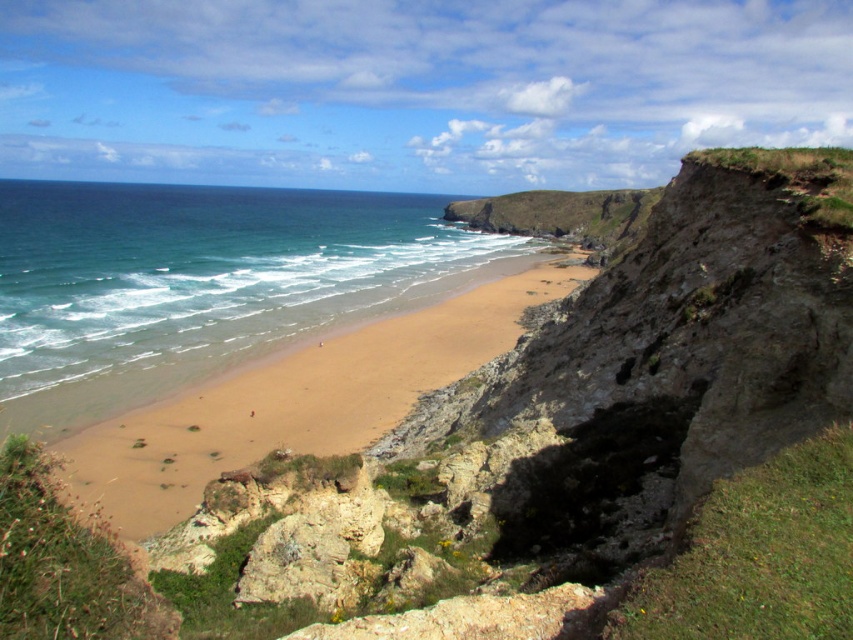
Question: Observing the image, what is the correct spatial positioning of blue water at center in reference to brown sandy beach at center?

Choices:
 (A) below
 (B) above

Answer: (B)

Question: Which point is farther from the camera taking this photo?

Choices:
 (A) (428, 308)
 (B) (219, 209)

Answer: (B)

Question: Does blue water at center have a larger size compared to brown sandy beach at center?

Choices:
 (A) yes
 (B) no

Answer: (A)

Question: Does blue water at center appear over brown sandy beach at center?

Choices:
 (A) no
 (B) yes

Answer: (B)

Question: Which point is farther to the camera?

Choices:
 (A) brown sandy beach at center
 (B) blue water at center

Answer: (B)